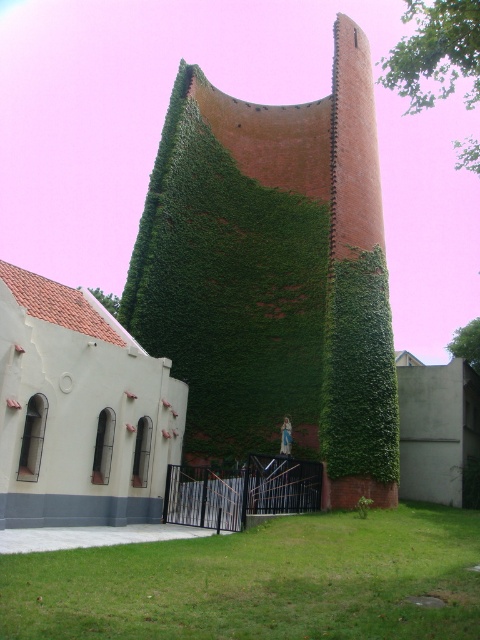
Can you confirm if green ivy-covered wall at center is taller than green leafy plant at lower center?

Correct, green ivy-covered wall at center is much taller as green leafy plant at lower center.

Can you confirm if green ivy-covered wall at center is positioned below green leafy plant at lower center?

Actually, green ivy-covered wall at center is above green leafy plant at lower center.

Which is behind, point (240, 173) or point (191, 600)?

The point (240, 173) is more distant.

The width and height of the screenshot is (480, 640). In order to click on green ivy-covered wall at center in this screenshot , I will do `click(268, 284)`.